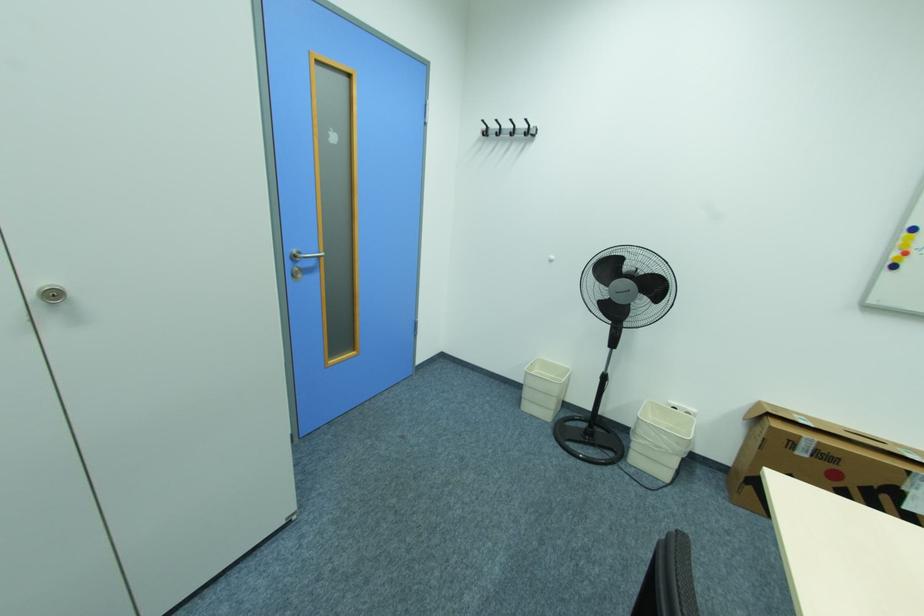
Identify the location of cardboard box. (821, 461).